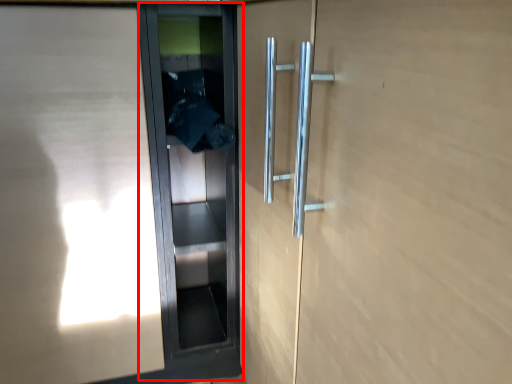
Question: Where is elevator door (annotated by the red box) located in relation to elevator door in the image?

Choices:
 (A) right
 (B) left

Answer: (A)